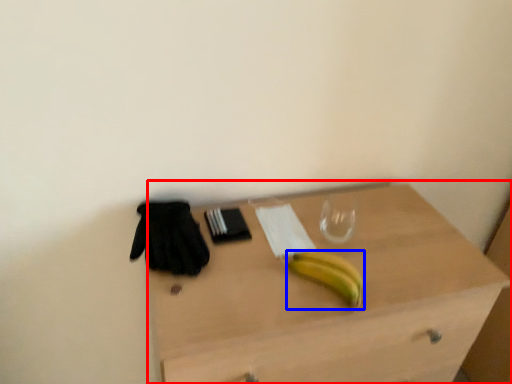
Question: Which point is further to the camera, desk (highlighted by a red box) or banana (highlighted by a blue box)?

Choices:
 (A) desk
 (B) banana

Answer: (B)